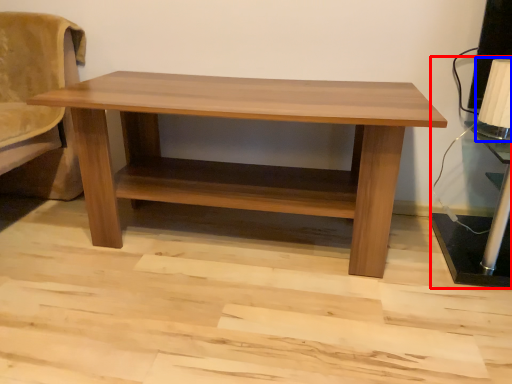
Question: Which object appears closest to the camera in this image, table lamp (highlighted by a red box) or table lamp (highlighted by a blue box)?

Choices:
 (A) table lamp
 (B) table lamp

Answer: (A)